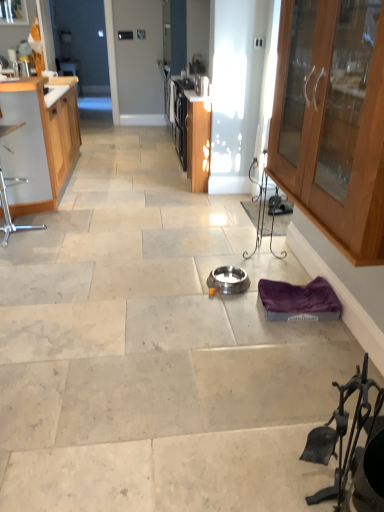
You are a GUI agent. You are given a task and a screenshot of the screen. Output one action in this format:
    pyautogui.click(x=<x>, y=<y>)
    Task: Click on the unoccupied space behind black wrought iron fireplace tools at lower right, which is the 1th chair from bottom to top
    The height and width of the screenshot is (512, 384).
    Given the screenshot: What is the action you would take?
    pyautogui.click(x=291, y=441)